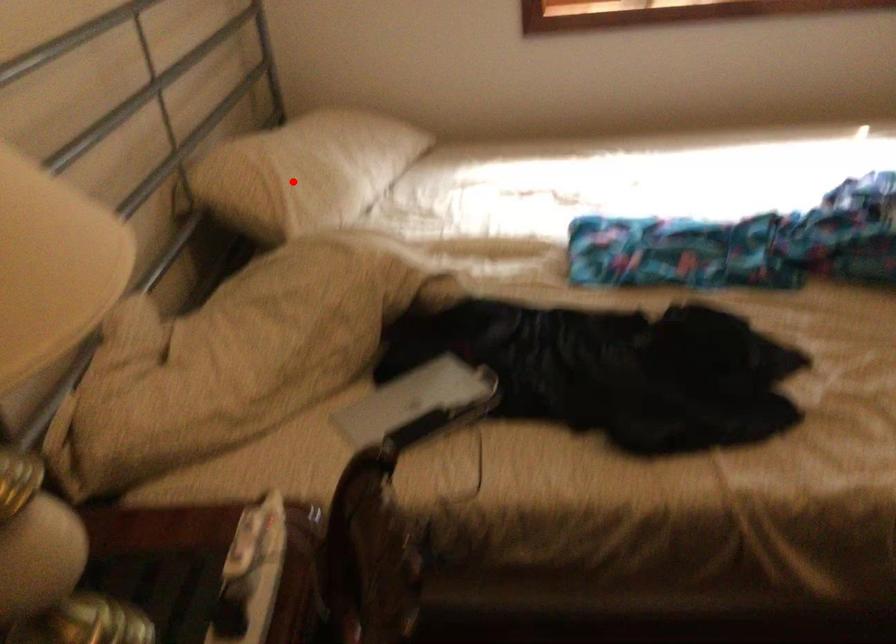
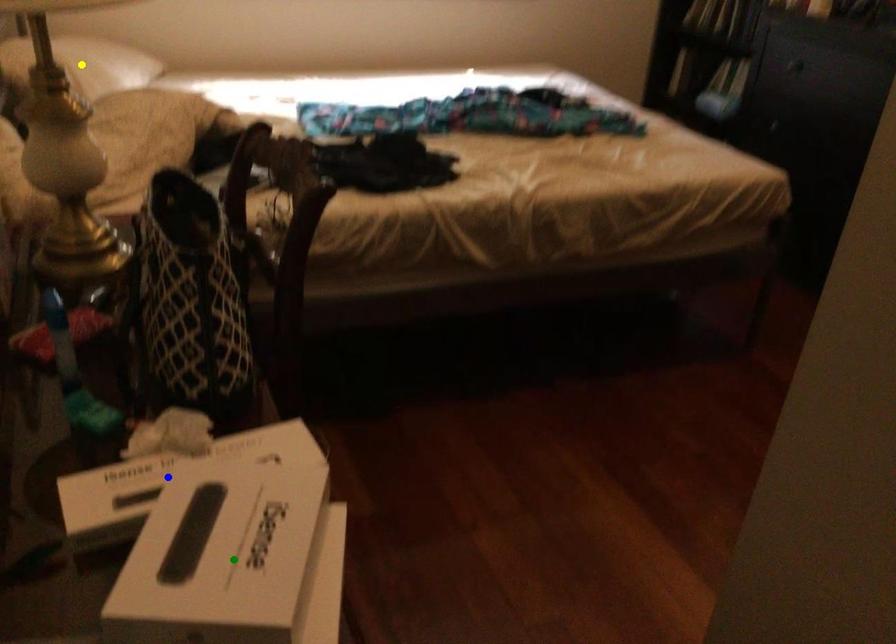
Question: I am providing you with two images of the same scene from different viewpoints. A red point is marked on the first image. You are given multiple points on the second image. Can you choose the point in image 2 that corresponds to the point in image 1?

Choices:
 (A) green point
 (B) yellow point
 (C) blue point

Answer: (B)